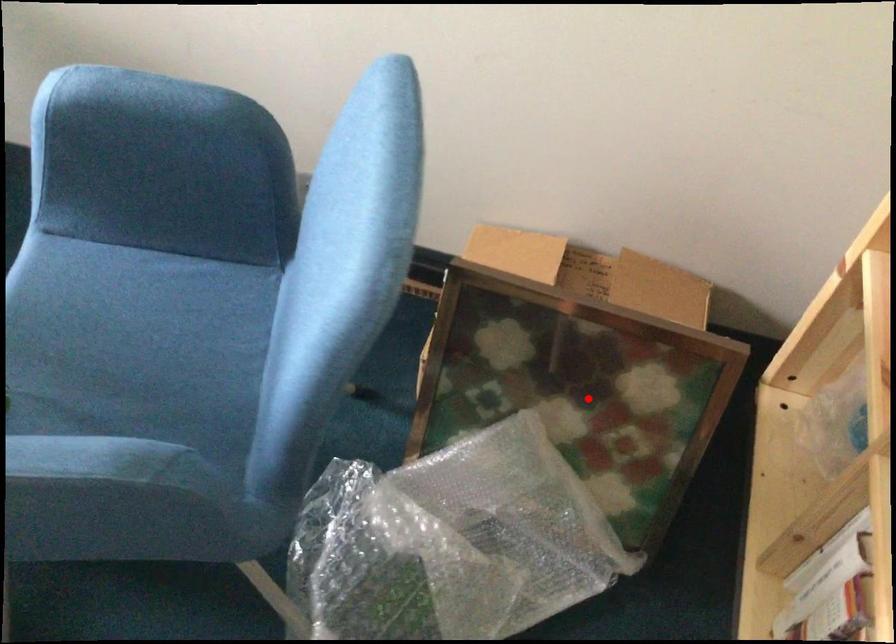
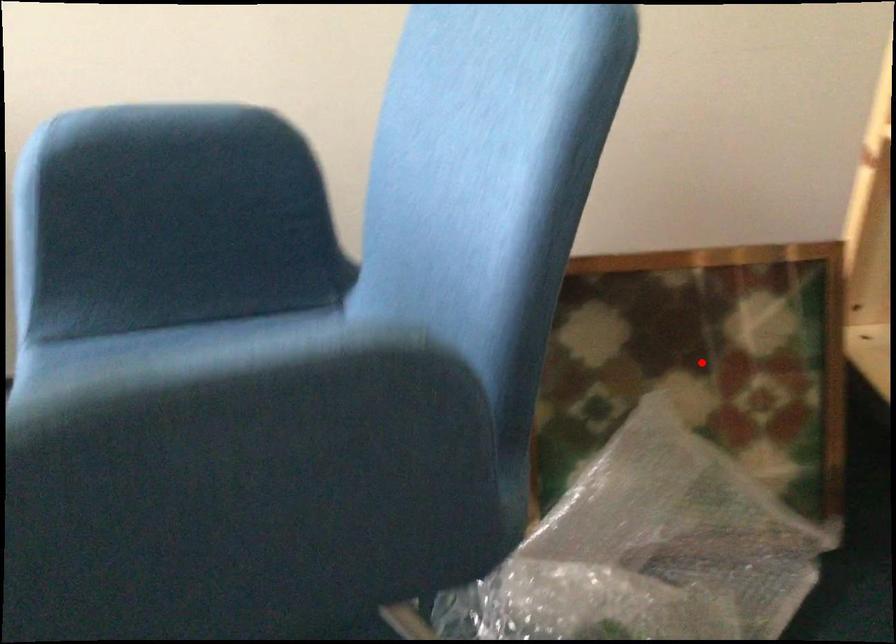
I am providing you with two images of the same scene from different viewpoints. A red point is marked on the first image and another point is marked on the second image. Do the highlighted points in image1 and image2 indicate the same real-world spot?

Yes